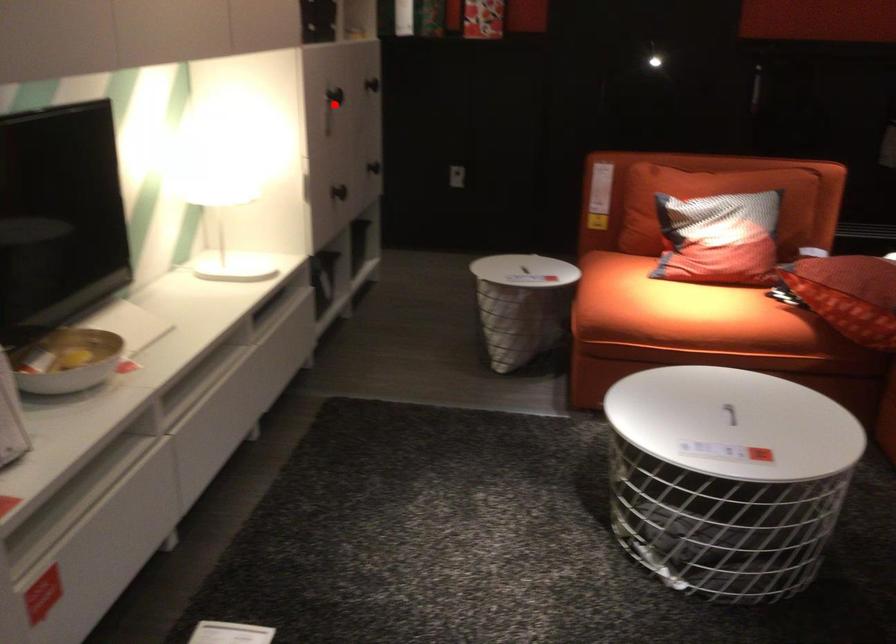
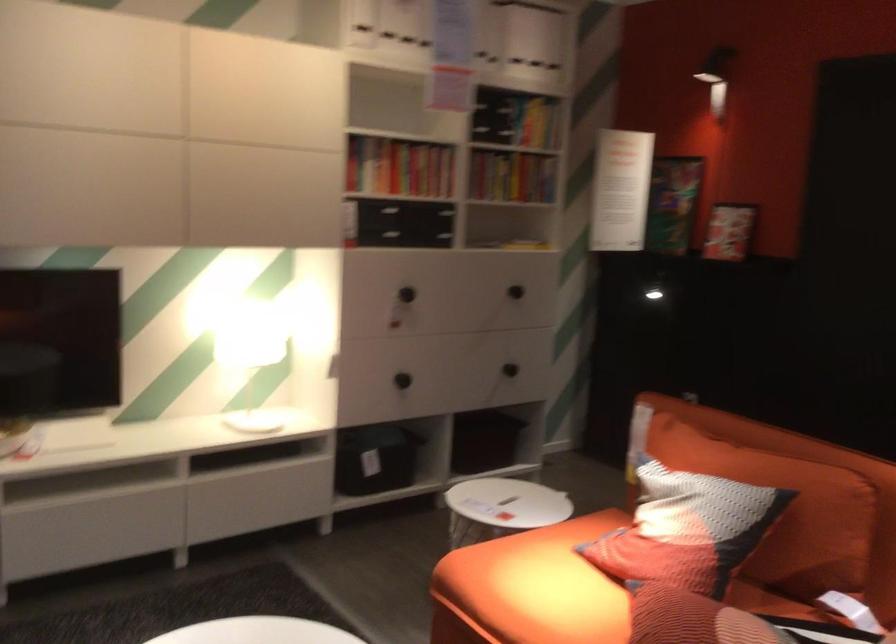
Where in the second image is the point corresponding to the highlighted location from the first image?

(407, 294)